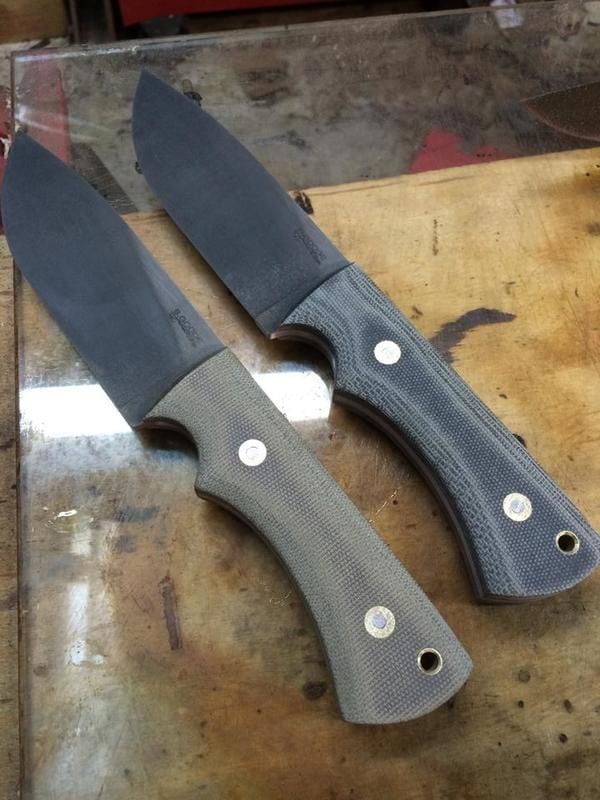
The height and width of the screenshot is (800, 600). Identify the location of glass. (405, 94).